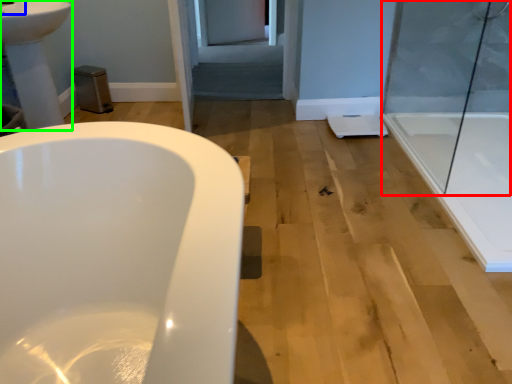
Question: Estimate the real-world distances between objects in this image. Which object is closer to shower door (highlighted by a red box), faucet (highlighted by a blue box) or sink (highlighted by a green box)?

Choices:
 (A) faucet
 (B) sink

Answer: (B)